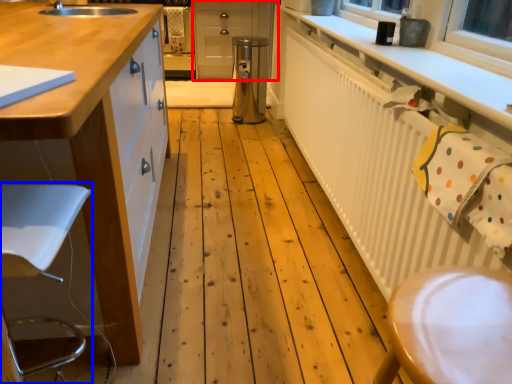
Question: Which object appears farthest to the camera in this image, cabinetry (highlighted by a red box) or swivel chair (highlighted by a blue box)?

Choices:
 (A) cabinetry
 (B) swivel chair

Answer: (A)